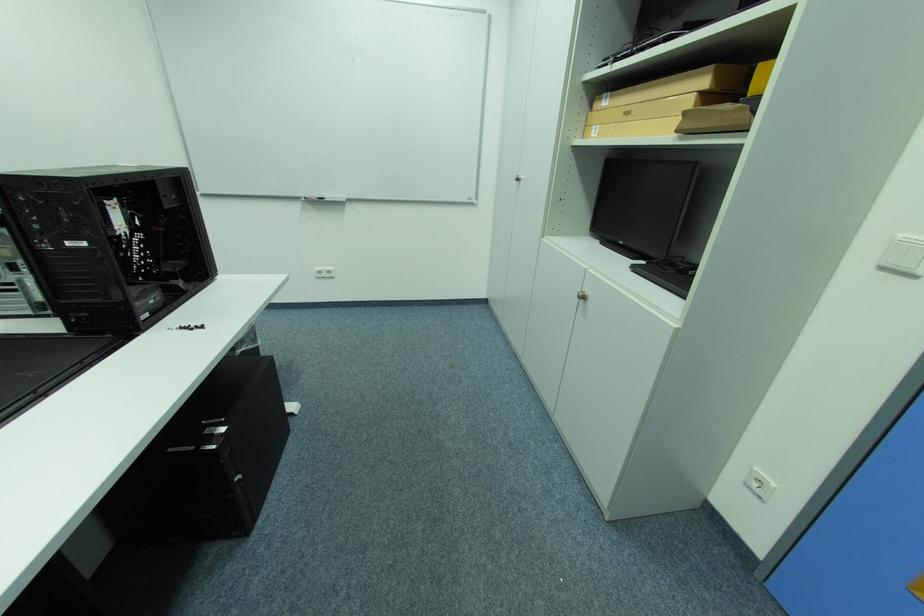
At what (x,y) coordinates should I click in order to perform the action: click on red whiteboard marker. Please return your answer as a coordinate pair (x, y). Looking at the image, I should click on (319, 198).